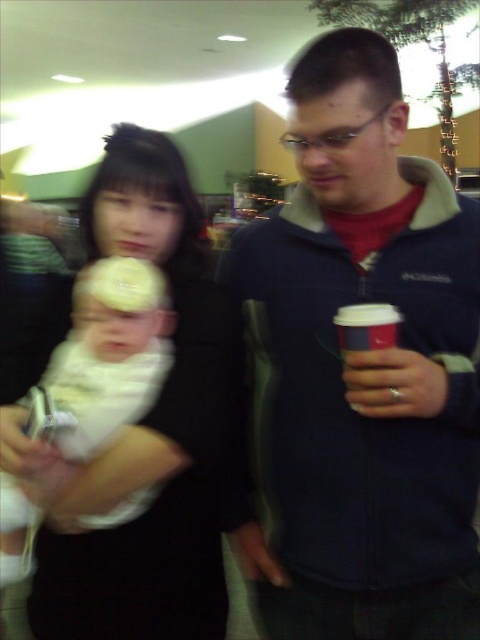
Question: Is white matte baby at center positioned at the back of white paper cup at right?

Choices:
 (A) no
 (B) yes

Answer: (B)

Question: Estimate the real-world distances between objects in this image. Which object is closer to the white soft fabric baby at left?

Choices:
 (A) white paper cup at right
 (B) white matte baby at center
 (C) blue fleece jacket at center

Answer: (B)

Question: Based on their relative distances, which object is nearer to the blue fleece jacket at center?

Choices:
 (A) white paper cup at right
 (B) white matte baby at center
 (C) white soft fabric baby at left

Answer: (A)

Question: Which point is farther to the camera?

Choices:
 (A) (470, 518)
 (B) (158, 518)
 (C) (7, 502)
 (D) (372, 324)

Answer: (A)

Question: Can you confirm if blue fleece jacket at center is positioned to the right of white paper cup at right?

Choices:
 (A) yes
 (B) no

Answer: (B)

Question: Is white matte baby at center to the right of white soft fabric baby at left from the viewer's perspective?

Choices:
 (A) no
 (B) yes

Answer: (A)